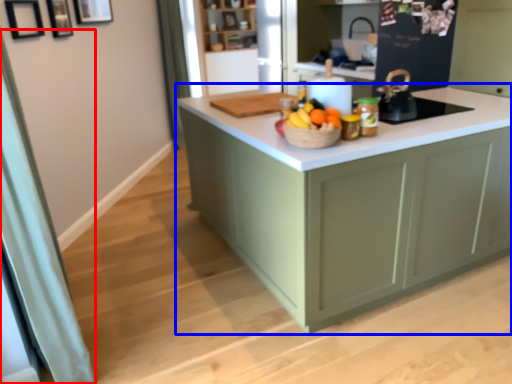
Question: Which of the following is the closest to the observer, curtain (highlighted by a red box) or cabinetry (highlighted by a blue box)?

Choices:
 (A) curtain
 (B) cabinetry

Answer: (A)